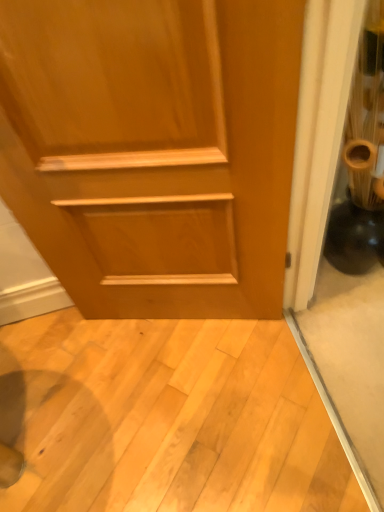
Measure the distance between black glossy vase at right and camera.

black glossy vase at right and camera are 26.94 inches apart from each other.

The width and height of the screenshot is (384, 512). Describe the element at coordinates (348, 246) in the screenshot. I see `black glossy vase at right` at that location.

You are a GUI agent. You are given a task and a screenshot of the screen. Output one action in this format:
    pyautogui.click(x=<x>, y=<y>)
    Task: Click on the black glossy vase at right
    Image resolution: width=384 pixels, height=512 pixels.
    Given the screenshot: What is the action you would take?
    pyautogui.click(x=348, y=246)

Image resolution: width=384 pixels, height=512 pixels. What are the coordinates of `black glossy vase at right` in the screenshot? It's located at click(x=348, y=246).